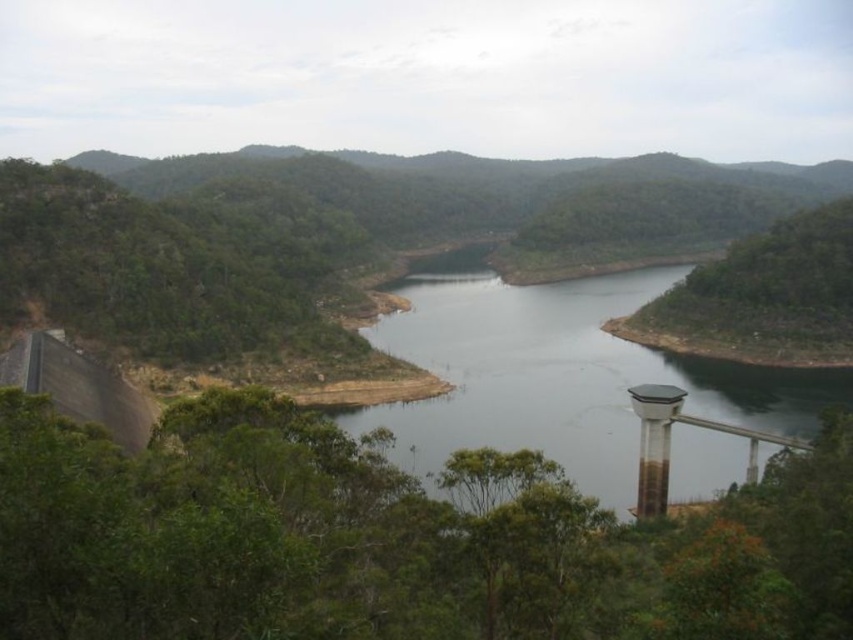
Is dark gray concrete river at center positioned before metallic gray water tower at lower right?

Yes, dark gray concrete river at center is closer to the viewer.

Between dark gray concrete river at center and metallic gray water tower at lower right, which one is positioned lower?

metallic gray water tower at lower right is below.

Is point (561, 340) positioned in front of point (633, 387)?

No.

The image size is (853, 640). In order to click on dark gray concrete river at center in this screenshot , I will do `click(560, 372)`.